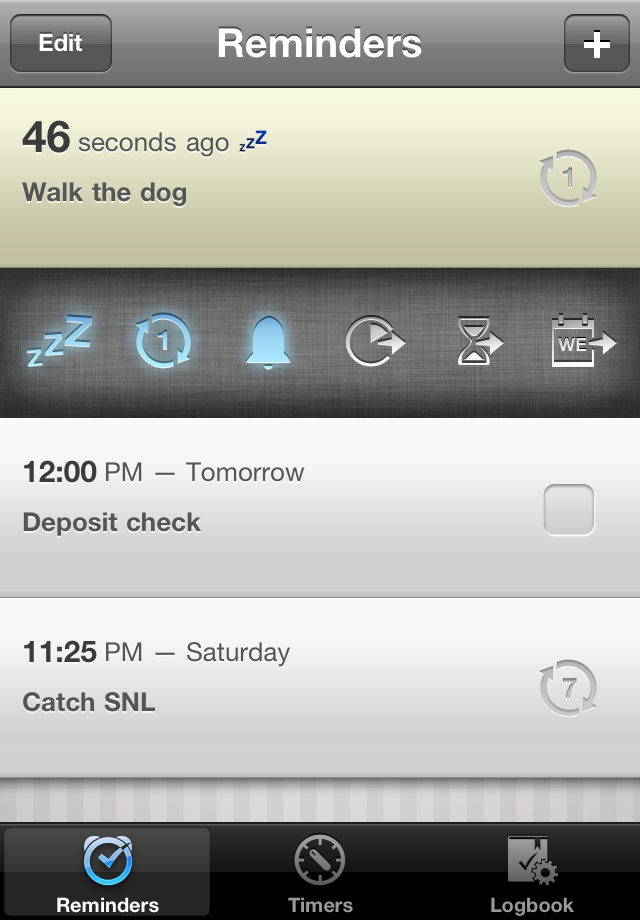
At what (x,y) coordinates should I click in order to perform the action: click on alarm button. Please return your answer as a coordinate pair (x, y). Looking at the image, I should click on pos(269,337).